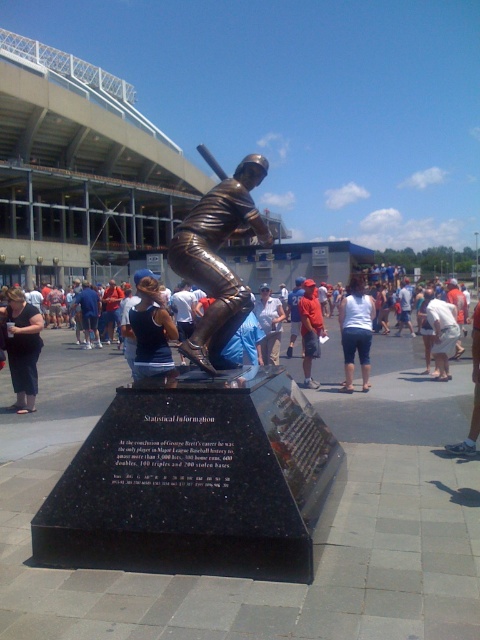
You are standing at the camera position and want to take a photo of the bronze statue at center. If your camera has a maximum focus range of 14 feet, will you be able to capture the statue clearly?

The bronze statue at center and camera are 14.11 feet apart, which exceeds the camera maximum focus range of 14 feet. Therefore, the statue will be out of focus and cannot be captured clearly.

You are a photographer at the baseball statue location. You see the white cotton tank top at center and the white cotton shirt at center. Which one is more to the right?

The white cotton tank top at center is positioned on the right side of the white cotton shirt at center, so the white cotton tank top at center is more to the right.